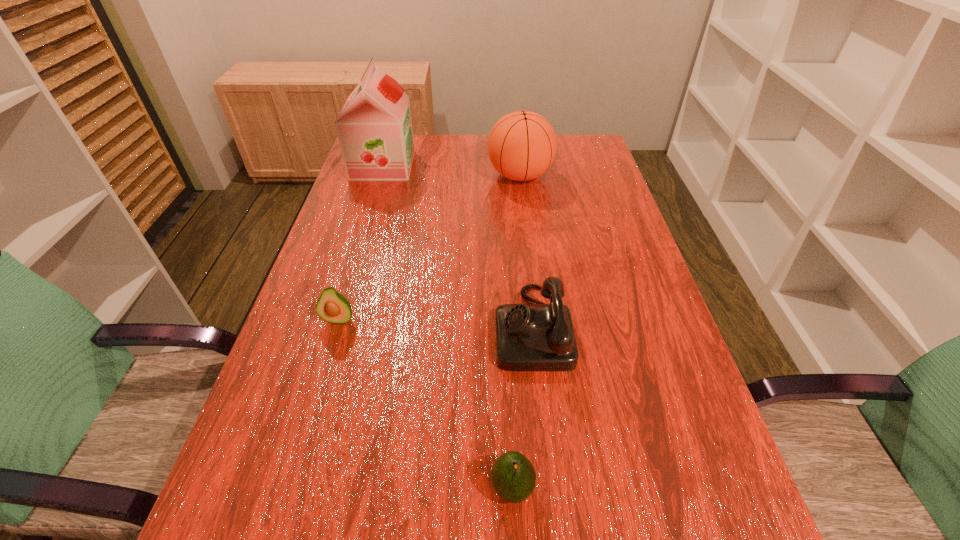
Where is `object that is the nearest to the left avocado`? The height and width of the screenshot is (540, 960). object that is the nearest to the left avocado is located at coordinates (529, 337).

Point out which object is positioned as the fourth nearest to the second tallest object. Please provide its 2D coordinates. Your answer should be formatted as a tuple, i.e. [(x, y)], where the tuple contains the x and y coordinates of a point satisfying the conditions above.

[(513, 476)]

The width and height of the screenshot is (960, 540). Find the location of `free space that satisfies the following two spatial constraints: 1. on the dial of the telephone; 2. on the front side of the right avocado`. free space that satisfies the following two spatial constraints: 1. on the dial of the telephone; 2. on the front side of the right avocado is located at coordinates (550, 488).

This screenshot has width=960, height=540. Identify the location of vacant space that satisfies the following two spatial constraints: 1. on the back side of the right avocado; 2. with the cap open on the tallest object. (496, 165).

I want to click on vacant space that satisfies the following two spatial constraints: 1. on the cut side of the right avocado; 2. on the left side of the farther avocado, so click(288, 488).

At what (x,y) coordinates should I click in order to perform the action: click on vacant space that satisfies the following two spatial constraints: 1. with the cap open on the tallest object; 2. on the right side of the nearest object. Please return your answer as a coordinate pair (x, y). Looking at the image, I should click on (283, 488).

The height and width of the screenshot is (540, 960). I want to click on vacant area that satisfies the following two spatial constraints: 1. with the cap open on the tallest object; 2. on the back side of the fourth shortest object, so click(379, 176).

At what (x,y) coordinates should I click in order to perform the action: click on vacant region that satisfies the following two spatial constraints: 1. on the front side of the basketball; 2. on the dial of the telephone. Please return your answer as a coordinate pair (x, y). Looking at the image, I should click on (539, 327).

Locate an element on the screen. free point that satisfies the following two spatial constraints: 1. with the cap open on the nearer avocado; 2. on the left side of the soya milk is located at coordinates (283, 488).

I want to click on free point that satisfies the following two spatial constraints: 1. on the back side of the nearest object; 2. with the cap open on the tallest object, so click(x=496, y=165).